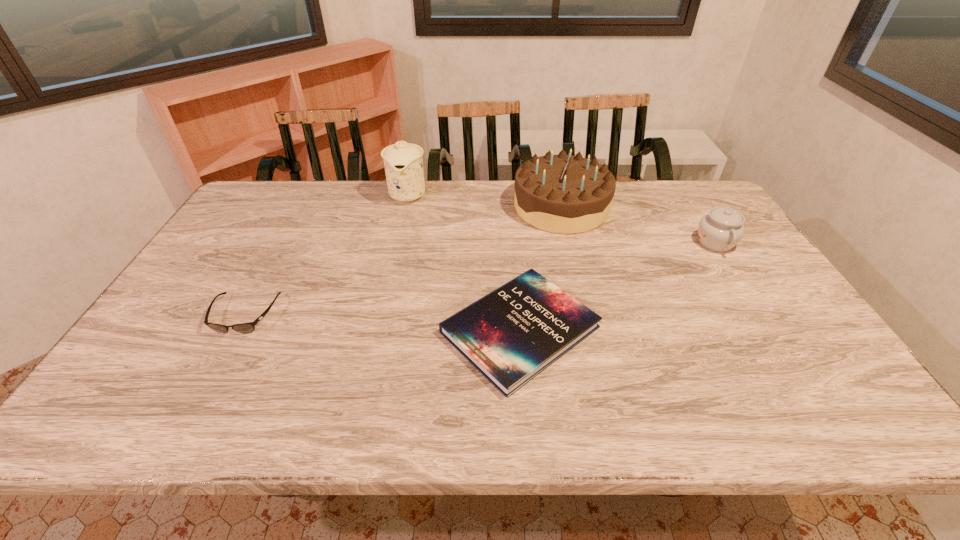
The image size is (960, 540). I want to click on the tallest object, so click(x=403, y=162).

Locate an element on the screen. This screenshot has width=960, height=540. the second object from left to right is located at coordinates (403, 162).

Where is `the second tallest object`? This screenshot has width=960, height=540. the second tallest object is located at coordinates point(561,193).

Where is `the rightmost object`? This screenshot has height=540, width=960. the rightmost object is located at coordinates (720, 230).

Where is `the third shortest object`? This screenshot has height=540, width=960. the third shortest object is located at coordinates (720, 230).

At what (x,y) coordinates should I click in order to perform the action: click on the leftmost object. Please return your answer as a coordinate pair (x, y). The height and width of the screenshot is (540, 960). Looking at the image, I should click on (249, 327).

This screenshot has height=540, width=960. Find the location of `sunglasses`. sunglasses is located at coordinates (249, 327).

The width and height of the screenshot is (960, 540). I want to click on hardback book, so click(512, 334).

Where is `vacant space positioned 0.130m on the spout of the tallest object`? This screenshot has height=540, width=960. vacant space positioned 0.130m on the spout of the tallest object is located at coordinates (399, 233).

Where is `free region located on the front-facing side of the fourth shortest object`? free region located on the front-facing side of the fourth shortest object is located at coordinates (399, 207).